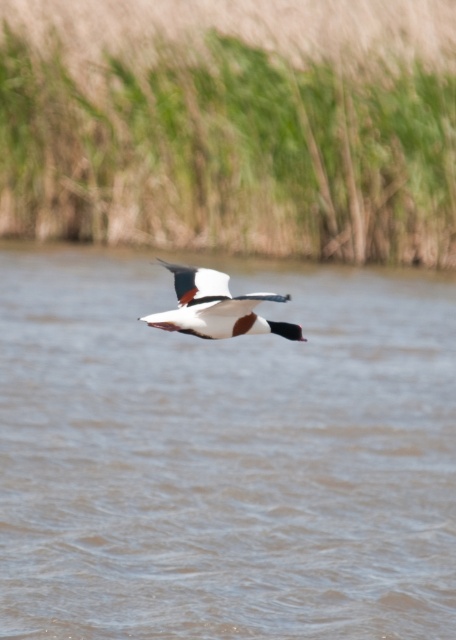
Question: Can you confirm if brown water at center is thinner than green grass at upper center?

Choices:
 (A) no
 (B) yes

Answer: (A)

Question: Which of the following is the farthest from the observer?

Choices:
 (A) (436, 461)
 (B) (5, 211)

Answer: (B)

Question: Based on their relative distances, which object is farther from the brown water at center?

Choices:
 (A) green grass at upper center
 (B) white glossy bird at center

Answer: (A)

Question: Is brown water at center positioned in front of green grass at upper center?

Choices:
 (A) yes
 (B) no

Answer: (A)

Question: Which is farther from the white glossy bird at center?

Choices:
 (A) brown water at center
 (B) green grass at upper center

Answer: (B)

Question: Does green grass at upper center have a smaller size compared to white glossy bird at center?

Choices:
 (A) no
 (B) yes

Answer: (B)